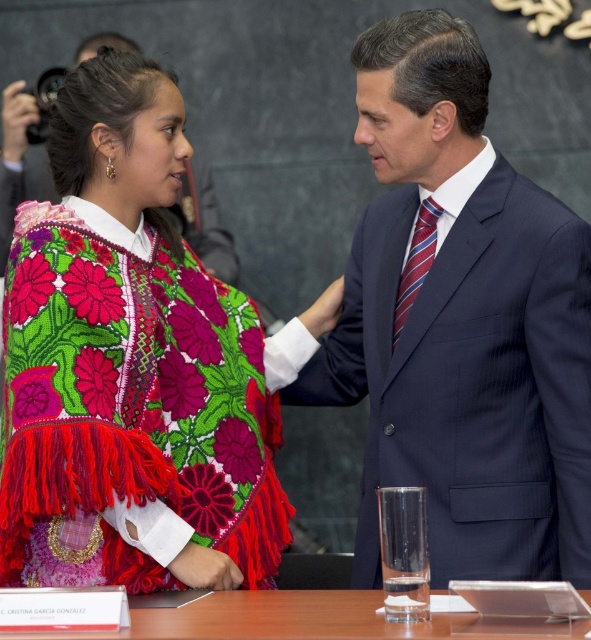
Can you confirm if embroidered wool poncho at center is taller than transparent glass at center?

Indeed, embroidered wool poncho at center has a greater height compared to transparent glass at center.

Does embroidered wool poncho at center appear on the left side of transparent glass at center?

Indeed, embroidered wool poncho at center is positioned on the left side of transparent glass at center.

Identify the location of embroidered wool poncho at center. coord(129,412).

Does dark blue pinstripe suit at center appear over embroidered wool poncho at center?

Yes.

Is dark blue pinstripe suit at center thinner than embroidered wool poncho at center?

Incorrect, dark blue pinstripe suit at center's width is not less than embroidered wool poncho at center's.

Find the location of a particular element. dark blue pinstripe suit at center is located at coordinates (462, 324).

Is matte black suit at center taller than striped silk tie at center?

Indeed, matte black suit at center has a greater height compared to striped silk tie at center.

Is matte black suit at center smaller than striped silk tie at center?

→ Incorrect, matte black suit at center is not smaller in size than striped silk tie at center.

Which is behind, point (125, 38) or point (410, 298)?

Point (125, 38)

Locate an element on the screen. matte black suit at center is located at coordinates (204, 224).